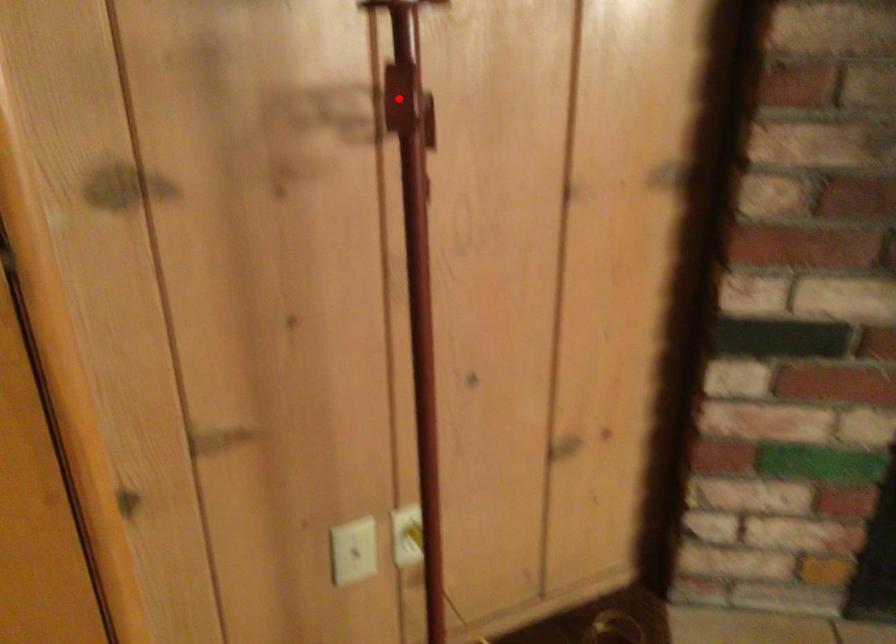
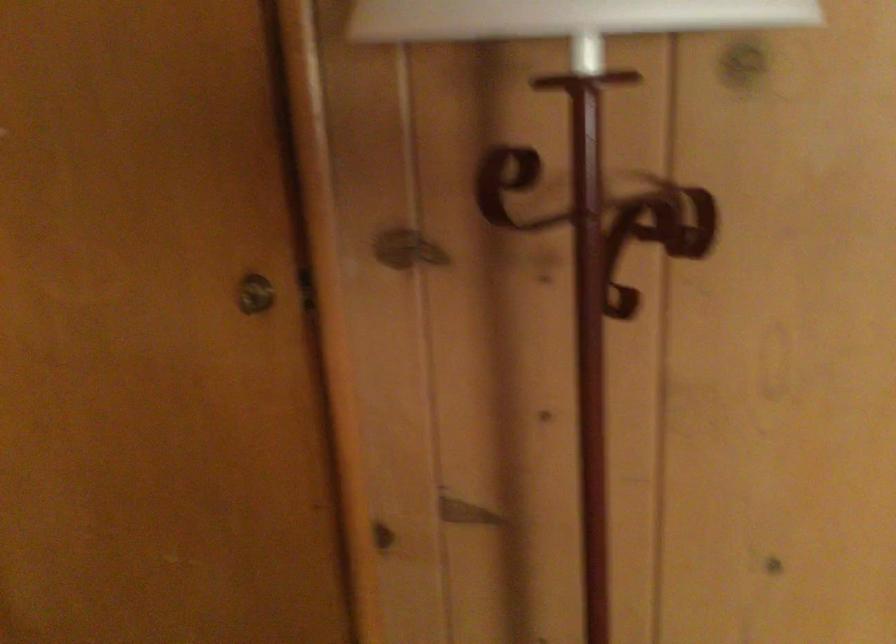
Question: I am providing you with two images of the same scene from different viewpoints. A red point is marked on the first image. At the location where the point appears in image 1, is it still visible in image 2?

Choices:
 (A) Yes
 (B) No

Answer: (B)